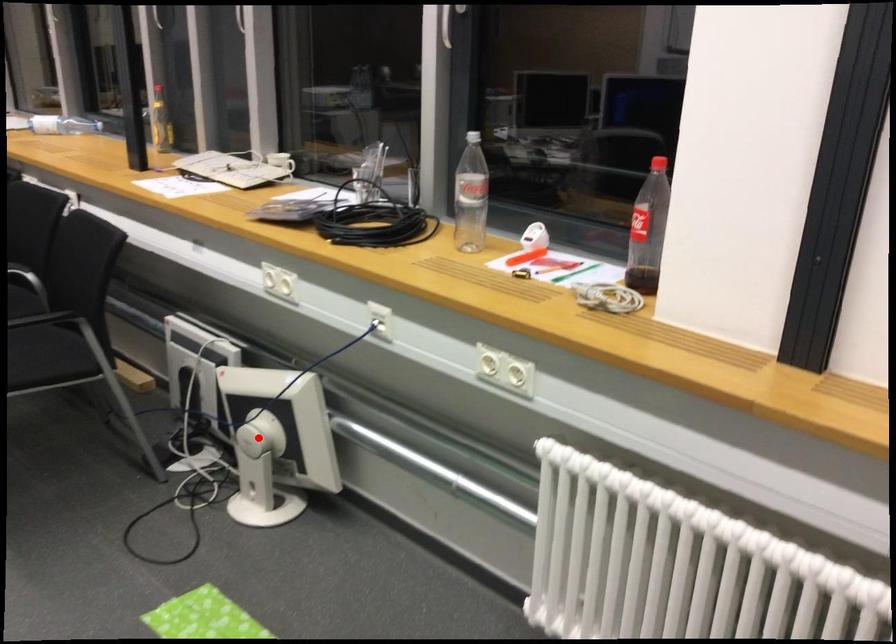
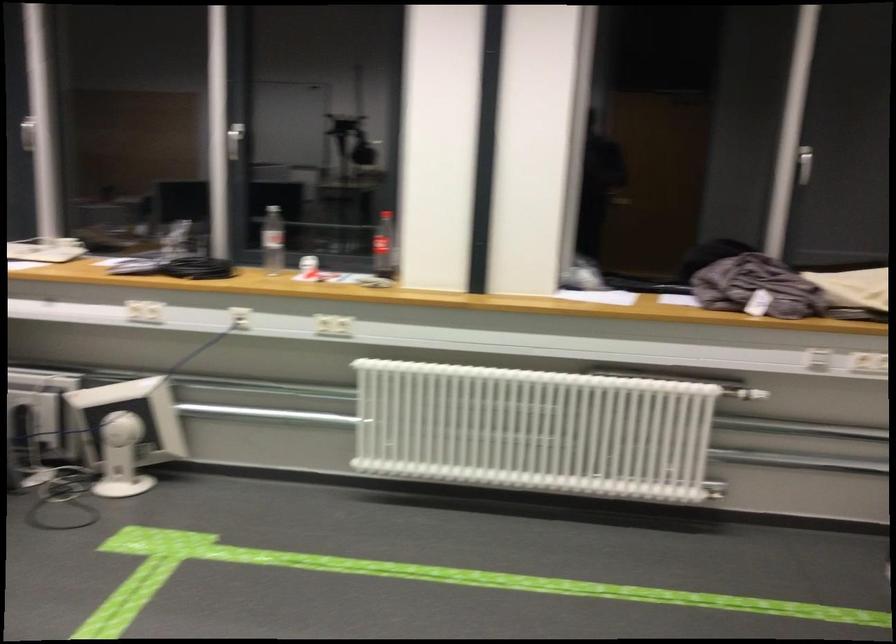
Question: I am providing you with two images of the same scene from different viewpoints. A red point is shown in image1. For the corresponding object point in image2, is it positioned nearer or farther from the camera?

Choices:
 (A) Nearer
 (B) Farther

Answer: (B)